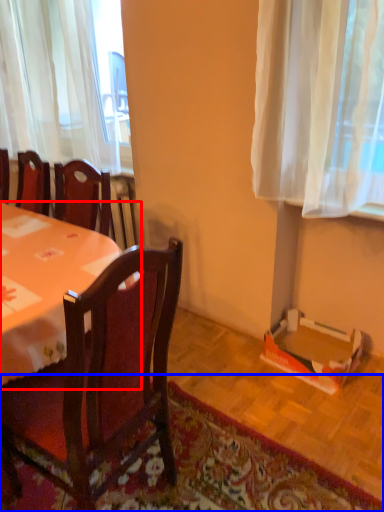
Question: Which point is further to the camera, desk (highlighted by a red box) or mat (highlighted by a blue box)?

Choices:
 (A) desk
 (B) mat

Answer: (A)